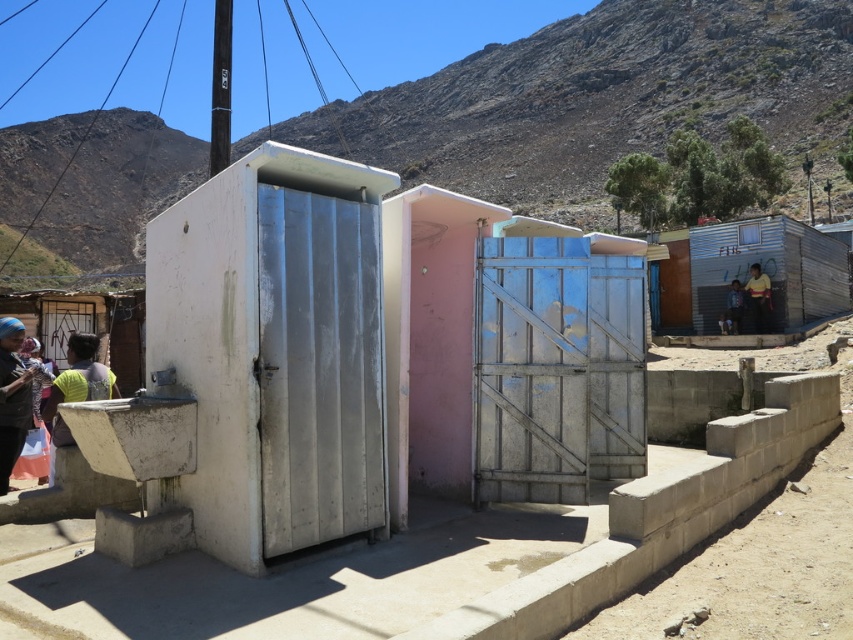
Question: Observing the image, what is the correct spatial positioning of metallic corrugated hut at center right in reference to matte blue shirt at lower left?

Choices:
 (A) below
 (B) above

Answer: (B)

Question: Is matte blue shirt at lower left smaller than yellow shirt at center?

Choices:
 (A) yes
 (B) no

Answer: (A)

Question: Does metallic corrugated hut at center right have a smaller size compared to green fabric shirt at left?

Choices:
 (A) yes
 (B) no

Answer: (B)

Question: Which is nearer to the matte blue shirt at lower left?

Choices:
 (A) yellow shirt at center
 (B) metallic corrugated hut at center right

Answer: (A)

Question: Which of these objects is positioned farthest from the matte blue shirt at lower left?

Choices:
 (A) blue fabric headscarf at lower left
 (B) yellow shirt at center
 (C) green fabric shirt at left
 (D) metallic corrugated hut at center right

Answer: (D)

Question: Among these objects, which one is nearest to the camera?

Choices:
 (A) metallic corrugated hut at center right
 (B) blue fabric headscarf at lower left
 (C) yellow shirt at right
 (D) green fabric shirt at left

Answer: (D)